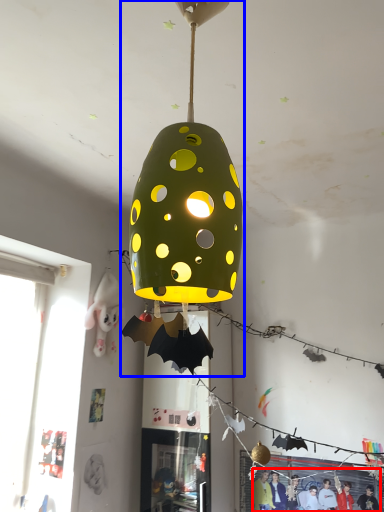
Question: Which object is closer to the camera taking this photo, person (highlighted by a red box) or lamp (highlighted by a blue box)?

Choices:
 (A) person
 (B) lamp

Answer: (B)